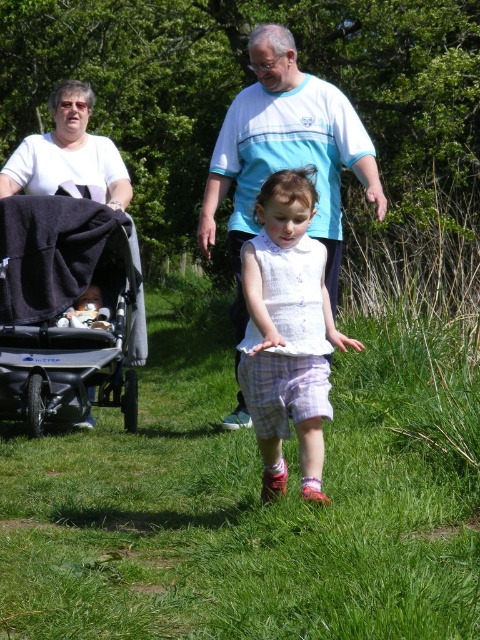
Between point (68, 342) and point (297, 355), which one is positioned in front?

Point (297, 355)

Is silver metallic stroller at left above white cotton dress at center?

Correct, silver metallic stroller at left is located above white cotton dress at center.

Which is in front, point (82, 419) or point (328, 349)?

Point (328, 349)

I want to click on silver metallic stroller at left, so click(x=64, y=308).

Is point (83, 275) positioned in front of point (0, 186)?

Yes, it is.

Can you confirm if silver metallic stroller at left is positioned to the left of white cotton t-shirt at upper left?

Yes, silver metallic stroller at left is to the left of white cotton t-shirt at upper left.

Which is in front, point (64, 376) or point (54, 192)?

Point (64, 376) is more forward.

At what (x,y) coordinates should I click in order to perform the action: click on silver metallic stroller at left. Please return your answer as a coordinate pair (x, y). The width and height of the screenshot is (480, 640). Looking at the image, I should click on 64,308.

Is silver metallic stroller at left to the right of light blue cotton shirt at center from the viewer's perspective?

No, silver metallic stroller at left is not to the right of light blue cotton shirt at center.

Is silver metallic stroller at left wider than light blue cotton shirt at center?

In fact, silver metallic stroller at left might be narrower than light blue cotton shirt at center.

Where is `silver metallic stroller at left`? The width and height of the screenshot is (480, 640). silver metallic stroller at left is located at coordinates (64, 308).